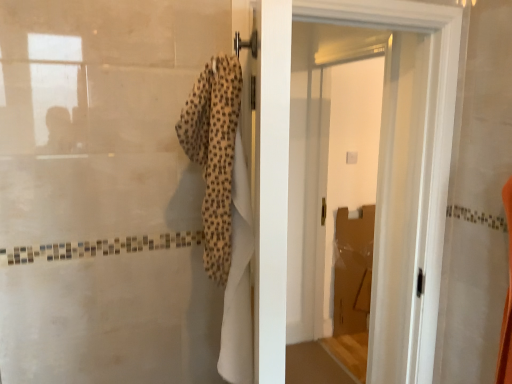
Question: Would you say beige textured towel at center is to the left or to the right of white glossy door at center in the picture?

Choices:
 (A) right
 (B) left

Answer: (B)

Question: From the image's perspective, relative to white glossy door at center, is beige textured towel at center above or below?

Choices:
 (A) above
 (B) below

Answer: (A)

Question: Estimate the real-world distances between objects in this image. Which object is farther from the white glossy door at upper center?

Choices:
 (A) white glossy door at center
 (B) beige textured towel at center

Answer: (B)

Question: Estimate the real-world distances between objects in this image. Which object is farther from the white glossy door at upper center?

Choices:
 (A) beige textured towel at center
 (B) white glossy door at center

Answer: (A)